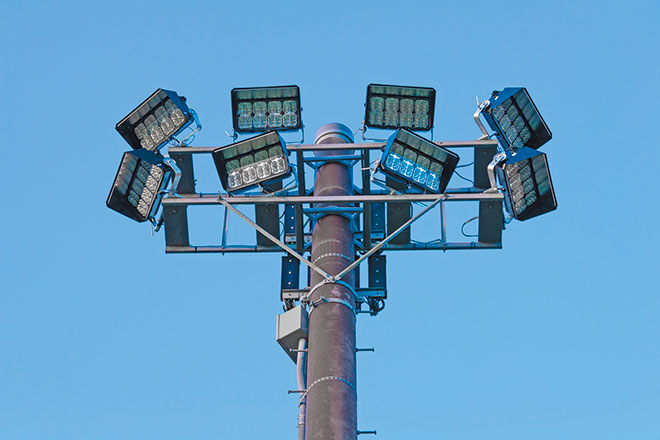
Image resolution: width=660 pixels, height=440 pixels. I want to click on light panels, so click(150, 122), click(150, 180), click(274, 110), click(261, 162), click(401, 97), click(411, 164), click(502, 126), click(525, 188).